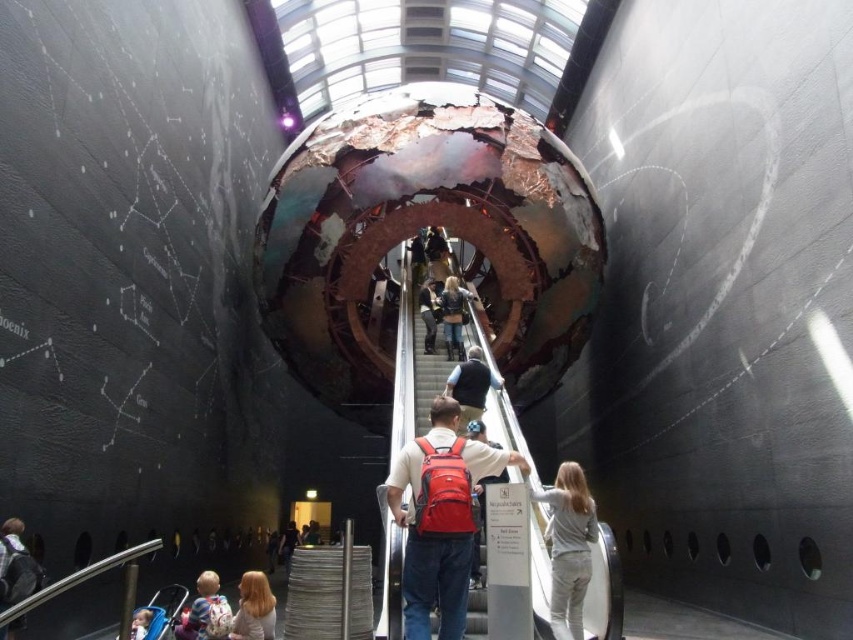
Question: Is blonde hair at center thinner than matte black jacket at center?

Choices:
 (A) yes
 (B) no

Answer: (B)

Question: Is red backpack at center wider than blonde hair at center?

Choices:
 (A) yes
 (B) no

Answer: (B)

Question: Based on their relative distances, which object is farther from the light brown fabric baby at lower left?

Choices:
 (A) light gray fabric jacket at center
 (B) matte black backpack at center

Answer: (B)

Question: Among these points, which one is farthest from the camera?

Choices:
 (A) (264, 628)
 (B) (434, 307)
 (C) (488, 449)

Answer: (B)

Question: Can you confirm if red backpack at center is positioned below metallic vest at center?

Choices:
 (A) yes
 (B) no

Answer: (A)

Question: Which point is farther from the camera taking this photo?

Choices:
 (A) (291, 548)
 (B) (576, 602)
 (C) (439, 589)

Answer: (A)